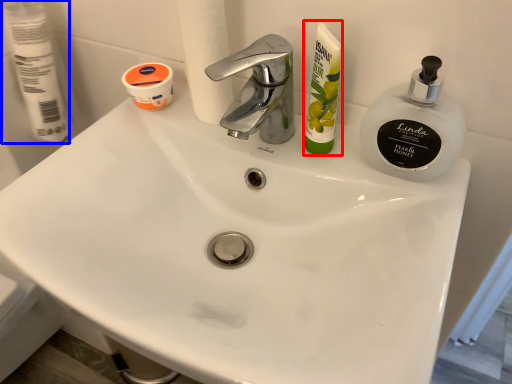
Question: Which object is closer to the camera taking this photo, toiletry (highlighted by a red box) or toilet paper (highlighted by a blue box)?

Choices:
 (A) toiletry
 (B) toilet paper

Answer: (A)